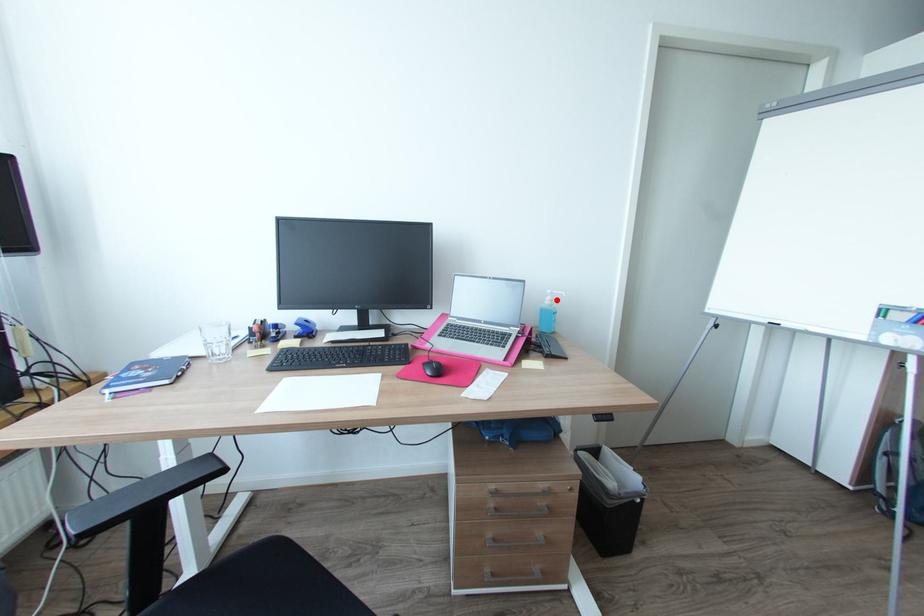
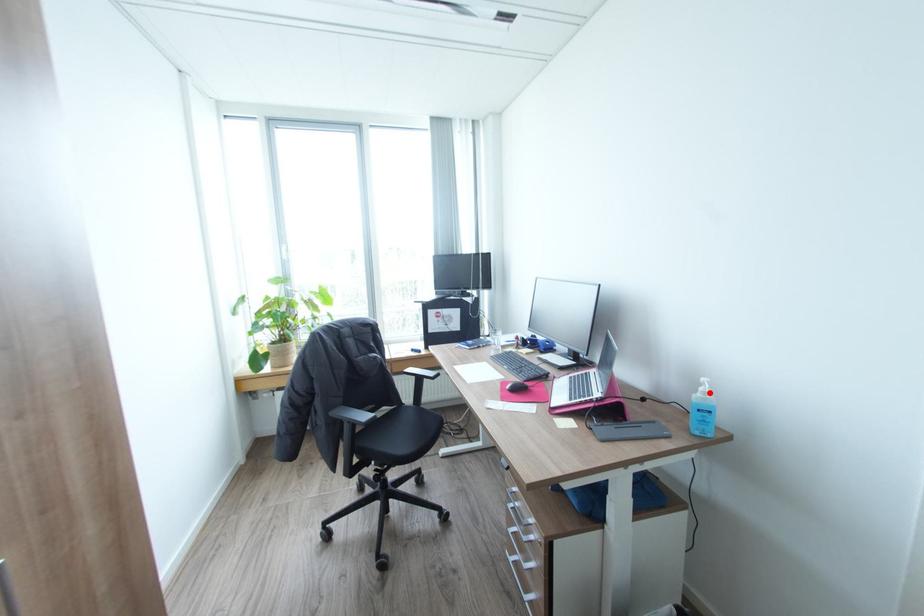
I am providing you with two images of the same scene from different viewpoints. A red point is marked on the first image and another point is marked on the second image. Does the point marked in image1 correspond to the same location as the one in image2?

Yes